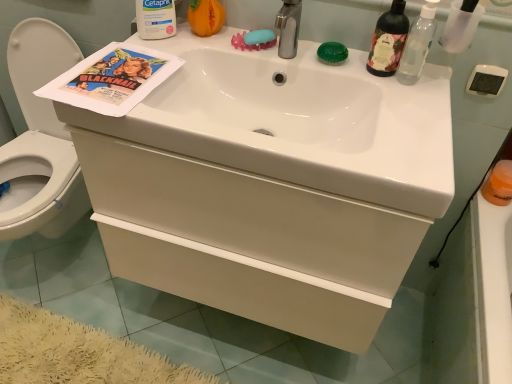
Locate an element on the screen. free space in front of transparent plastic bottle at upper right, which is counted as the third bottle, starting from the left is located at coordinates click(415, 109).